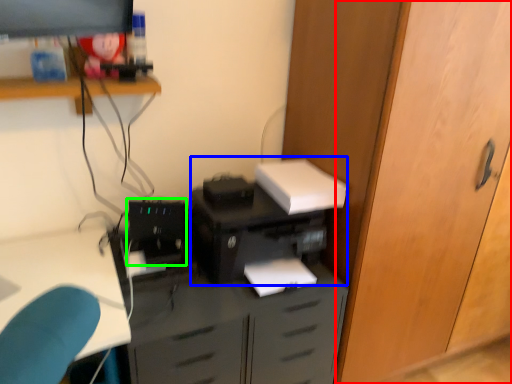
Question: Considering the real-world distances, which object is farthest from door (highlighted by a red box)? printer (highlighted by a blue box) or computer tower (highlighted by a green box)?

Choices:
 (A) printer
 (B) computer tower

Answer: (B)